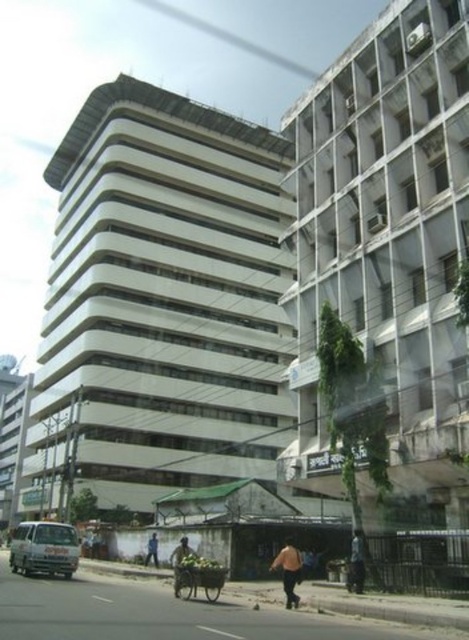
Question: Can you confirm if white matte van at lower left is smaller than orange fabric bag at center?

Choices:
 (A) yes
 (B) no

Answer: (B)

Question: Among these points, which one is farthest from the camera?

Choices:
 (A) (149, 541)
 (B) (22, 547)

Answer: (A)

Question: Is the position of brown fabric person at lower center less distant than that of orange fabric bag at center?

Choices:
 (A) yes
 (B) no

Answer: (A)

Question: Does white matte van at lower left appear under orange fabric bag at lower center?

Choices:
 (A) yes
 (B) no

Answer: (A)

Question: Which point appears closest to the camera in this image?

Choices:
 (A) (22, 536)
 (B) (156, 556)
 (C) (361, 593)
 (D) (173, 588)

Answer: (C)

Question: Among these points, which one is farthest from the camera?

Choices:
 (A) (182, 550)
 (B) (355, 554)
 (C) (287, 595)
 (D) (156, 547)

Answer: (D)